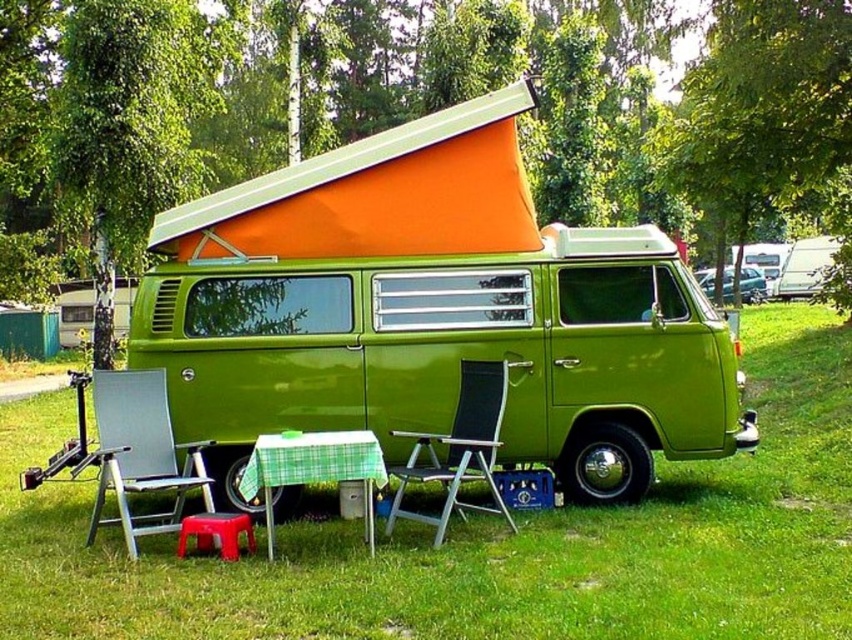
Question: Is green matte van at center positioned at the back of green checkered tablecloth at center?

Choices:
 (A) no
 (B) yes

Answer: (B)

Question: Is green matte van at center closer to camera compared to black mesh chair at center?

Choices:
 (A) yes
 (B) no

Answer: (B)

Question: Is green grass at lower center wider than rubberized plastic stool at lower center?

Choices:
 (A) no
 (B) yes

Answer: (B)

Question: Which point is farther to the camera?

Choices:
 (A) silver metallic folding chair at lower left
 (B) black mesh chair at center
 (C) green matte van at center
 (D) green grass at lower center

Answer: (C)

Question: Which of these objects is positioned farthest from the metallic silver minivan at upper right?

Choices:
 (A) silver metallic folding chair at lower left
 (B) green grass at lower center
 (C) green checkered tablecloth at center
 (D) rubberized plastic stool at lower center

Answer: (D)

Question: Which object appears closest to the camera in this image?

Choices:
 (A) silver metallic folding chair at lower left
 (B) green grass at lower center
 (C) rubberized plastic stool at lower center
 (D) green checkered tablecloth at center

Answer: (B)